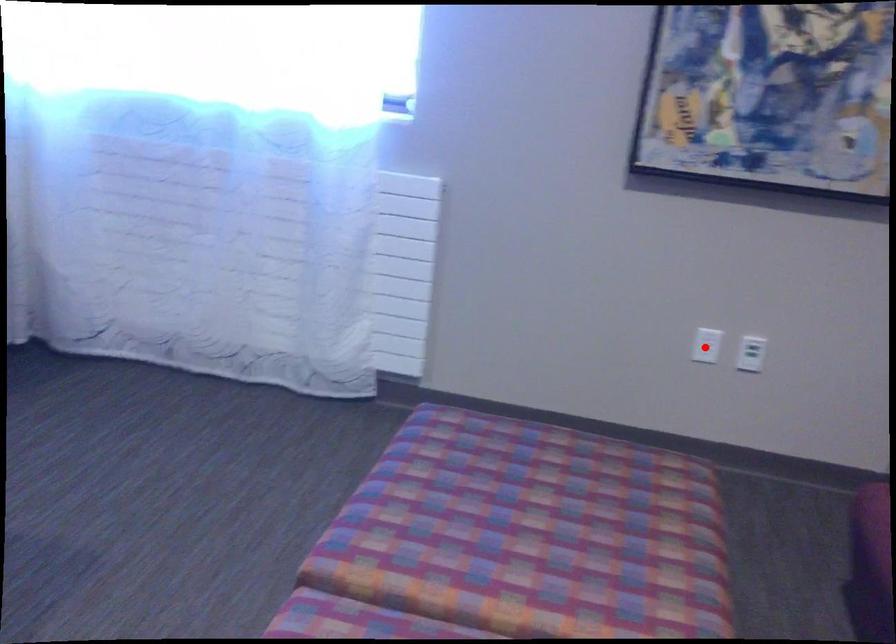
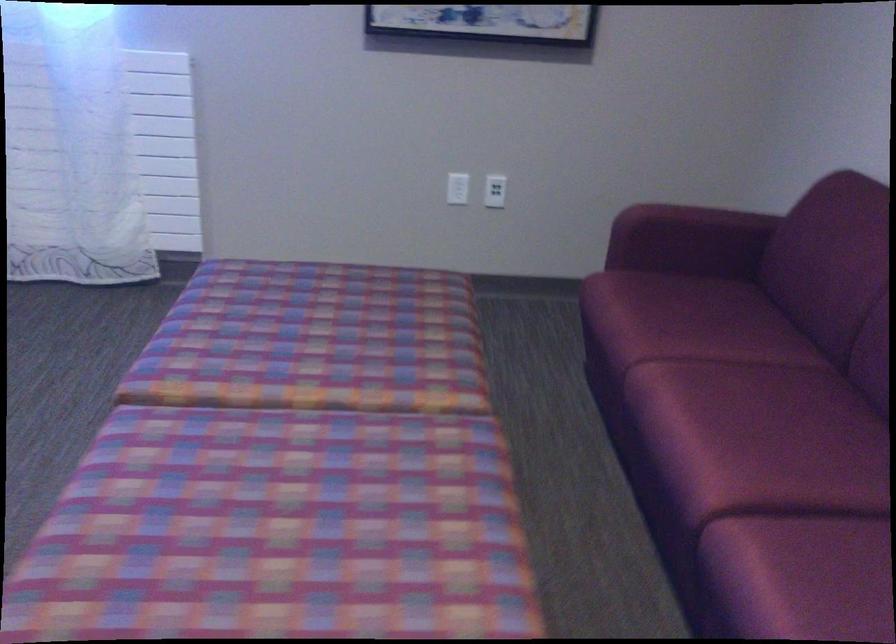
Question: I am providing you with two images of the same scene from different viewpoints. A red point is shown in image1. For the corresponding object point in image2, is it positioned nearer or farther from the camera?

Choices:
 (A) Nearer
 (B) Farther

Answer: (B)